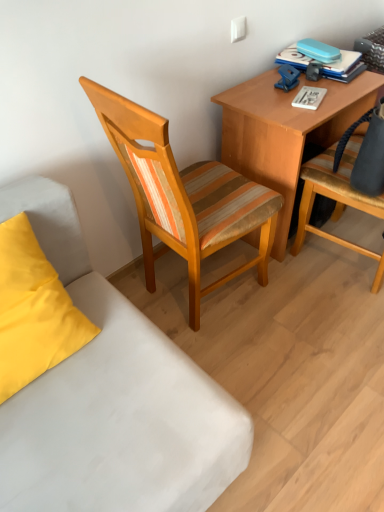
Locate an element on the screen. vacant space in striped fabric chair at right, the first chair viewed from the right (from a real-world perspective) is located at coordinates (345, 258).